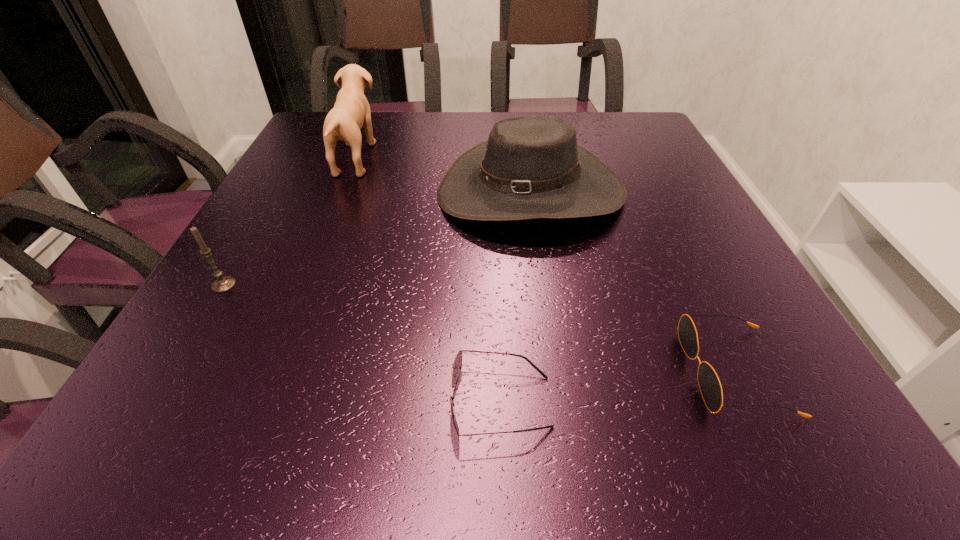
Where is `object located in the far left corner section of the desktop`? object located in the far left corner section of the desktop is located at coordinates (351, 111).

Where is `object that is at the near right corner`? object that is at the near right corner is located at coordinates (709, 383).

The width and height of the screenshot is (960, 540). What are the coordinates of `free space at the far edge of the desktop` in the screenshot? It's located at (471, 113).

This screenshot has width=960, height=540. In the image, there is a desktop. In order to click on vacant area at the near edge in this screenshot , I will do `click(436, 420)`.

The height and width of the screenshot is (540, 960). Find the location of `free space at the left edge of the desktop`. free space at the left edge of the desktop is located at coordinates (295, 170).

Locate an element on the screen. vacant space at the right edge of the desktop is located at coordinates (693, 204).

Find the location of a particular element. This screenshot has width=960, height=540. free space at the near left corner of the desktop is located at coordinates (220, 443).

In order to click on vacant space at the far right corner of the desktop in this screenshot , I will do `click(653, 133)`.

Where is `vacant space at the near right corner`? vacant space at the near right corner is located at coordinates (826, 418).

You are a GUI agent. You are given a task and a screenshot of the screen. Output one action in this format:
    pyautogui.click(x=<x>, y=<y>)
    Task: Click on the empty space between the left sunglasses and the third farthest object
    The height and width of the screenshot is (540, 960).
    Given the screenshot: What is the action you would take?
    pyautogui.click(x=362, y=343)